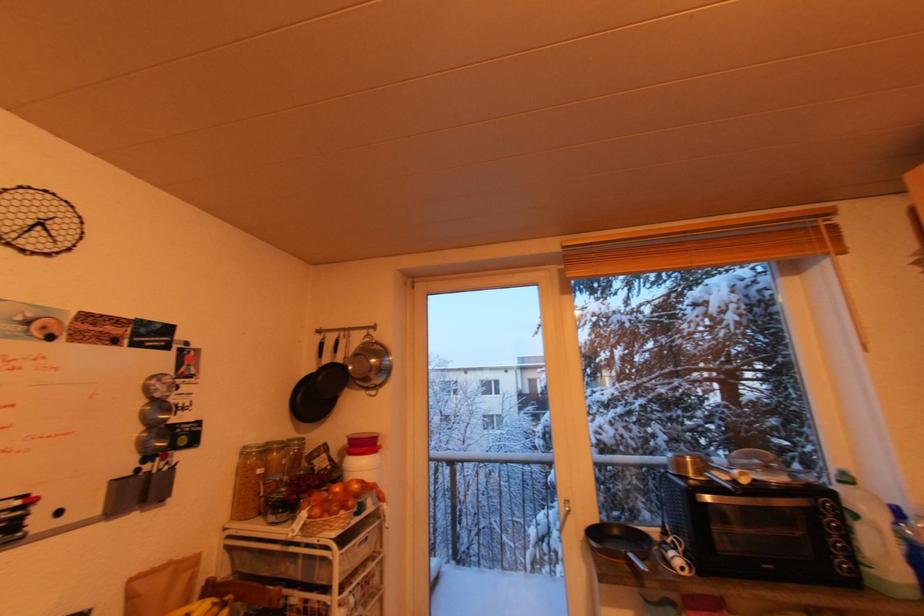
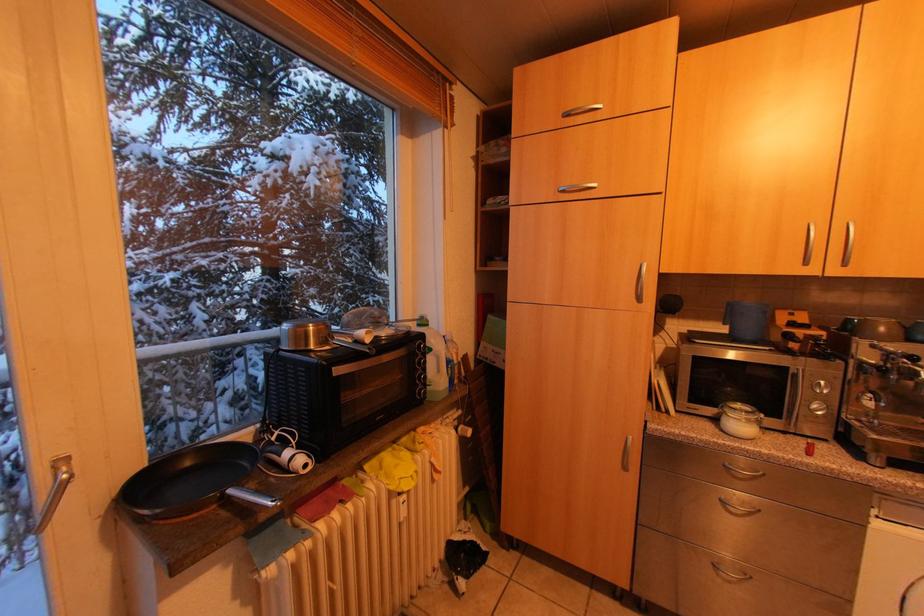
Question: The camera is either moving clockwise (left) or counter-clockwise (right) around the object. The first image is from the beginning of the video and the second image is from the end. Is the camera moving left or right when shooting the video?

Choices:
 (A) Left
 (B) Right

Answer: (A)